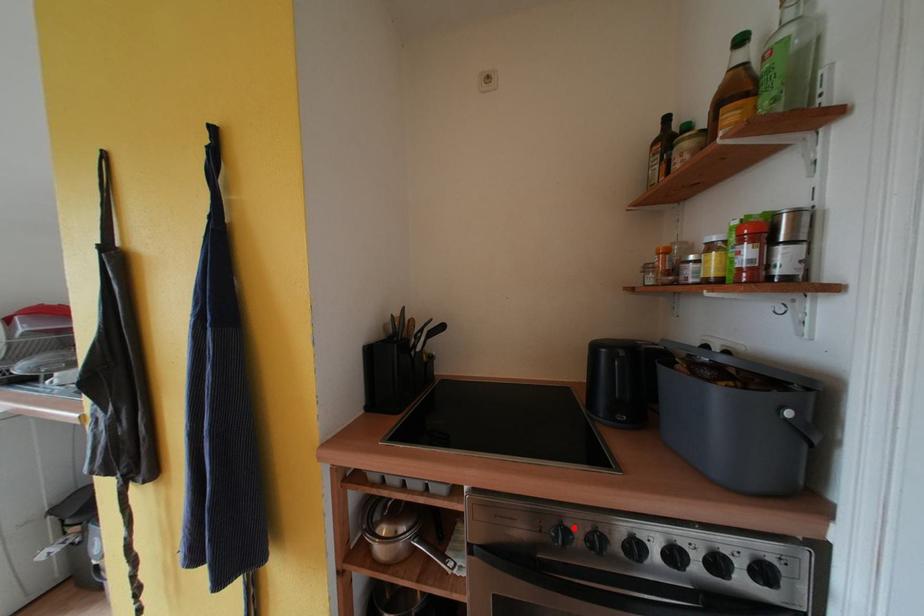
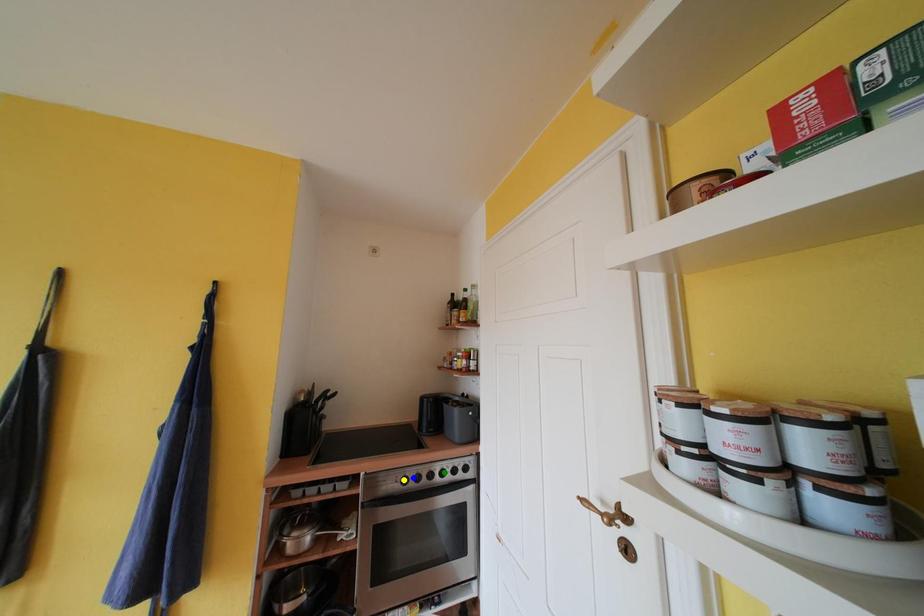
Question: I am providing you with two images of the same scene from different viewpoints. A red point is marked on the first image. You are given multiple points on the second image. In image 2, which mark is for the same physical point as the one in image 1?

Choices:
 (A) green point
 (B) yellow point
 (C) blue point

Answer: (C)